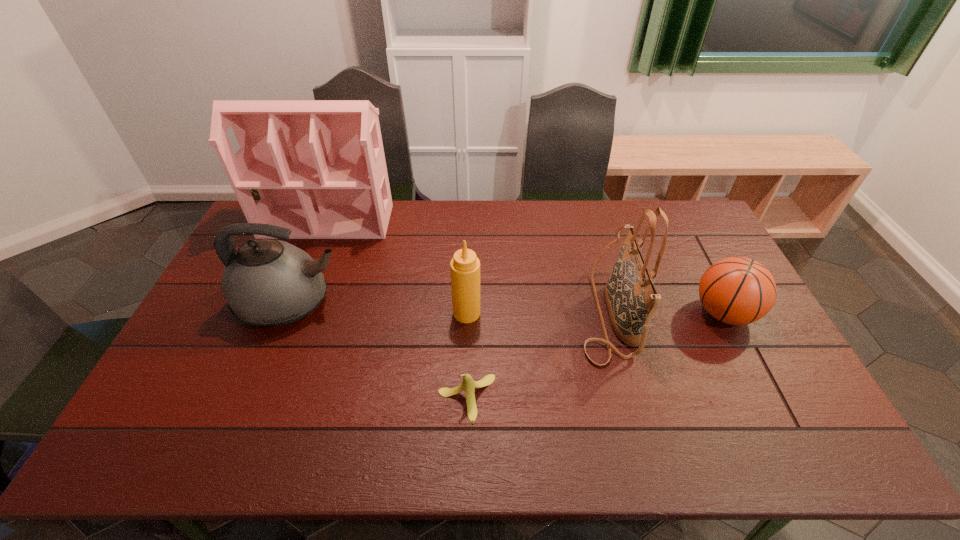
You are a GUI agent. You are given a task and a screenshot of the screen. Output one action in this format:
    pyautogui.click(x=<x>, y=<y>)
    Task: Click on the farthest object
    The image size is (960, 540).
    Given the screenshot: What is the action you would take?
    pyautogui.click(x=319, y=167)

The width and height of the screenshot is (960, 540). I want to click on the tallest object, so click(x=319, y=167).

The width and height of the screenshot is (960, 540). I want to click on the second object from right to left, so click(x=631, y=299).

Where is `the fifth shortest object`? the fifth shortest object is located at coordinates (631, 299).

This screenshot has height=540, width=960. Find the location of `kettle`. kettle is located at coordinates (266, 282).

I want to click on condiment, so click(x=464, y=267).

You are a GUI agent. You are given a task and a screenshot of the screen. Output one action in this format:
    pyautogui.click(x=<x>, y=<y>)
    Task: Click on the basketball
    This screenshot has height=540, width=960.
    Given the screenshot: What is the action you would take?
    pyautogui.click(x=736, y=290)

The image size is (960, 540). In order to click on the fifth tallest object in this screenshot , I will do `click(736, 290)`.

This screenshot has width=960, height=540. Find the location of `the nearest object`. the nearest object is located at coordinates (468, 384).

I want to click on banana, so click(x=468, y=384).